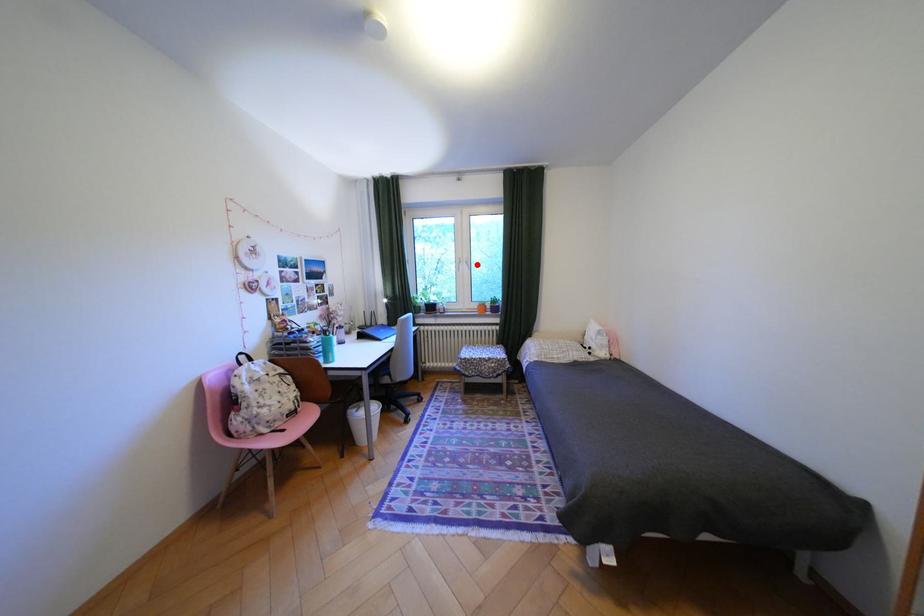
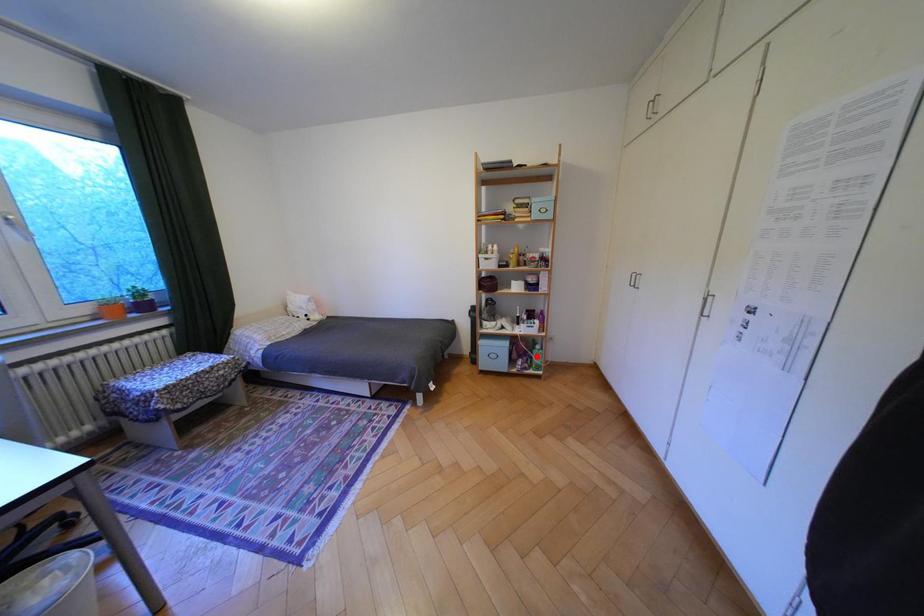
I am providing you with two images of the same scene from different viewpoints. A red point is marked on the first image and another point is marked on the second image. Is the marked point in image1 the same physical position as the marked point in image2?

No